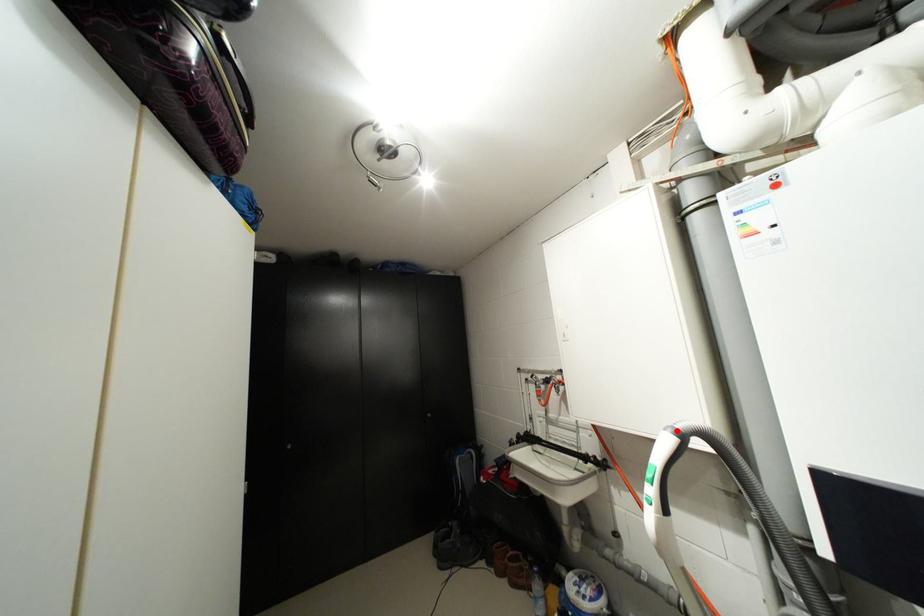
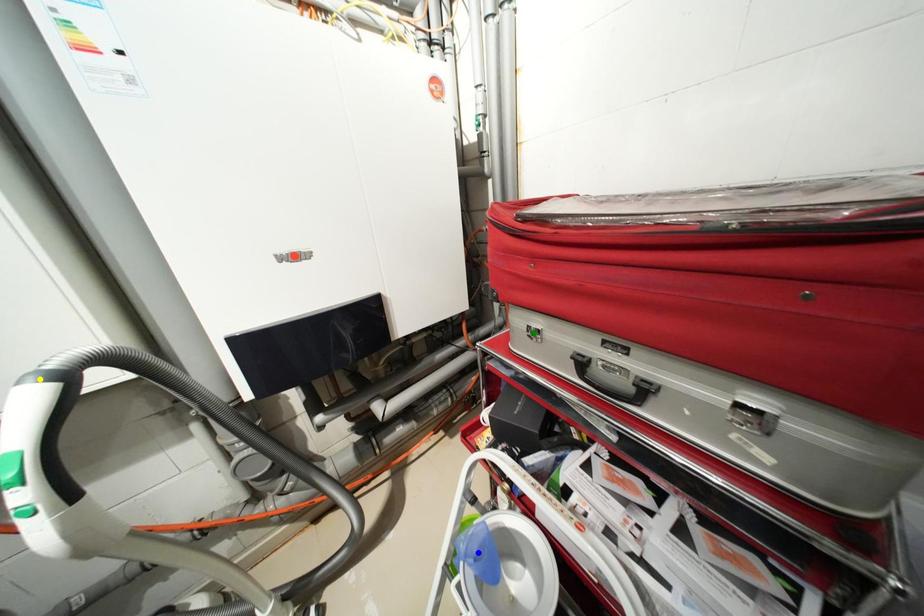
Question: I am providing you with two images of the same scene from different viewpoints. A red point is marked on the first image. You are given multiple points on the second image. In image 2, which mark is for the same physical point as the one in image 1?

Choices:
 (A) blue point
 (B) yellow point
 (C) green point

Answer: (B)